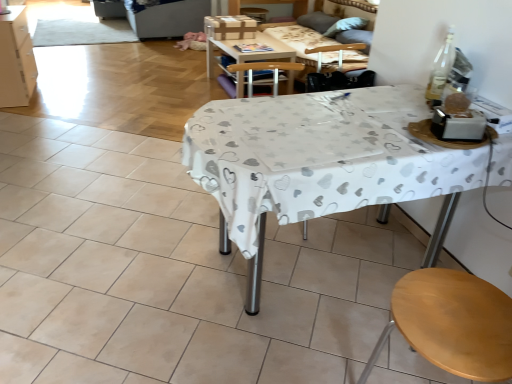
Question: From a real-world perspective, is white matte cabinet at left above or below white fabric-covered table at center?

Choices:
 (A) above
 (B) below

Answer: (B)

Question: Would you say white matte cabinet at left is to the left or to the right of white fabric-covered table at center in the picture?

Choices:
 (A) right
 (B) left

Answer: (B)

Question: Which object is the closest to the white fabric-covered table at center?

Choices:
 (A) brown cardboard box at upper center
 (B) wooden couch at upper center
 (C) white matte cabinet at left
 (D) wooden table at center

Answer: (D)

Question: Based on their relative distances, which object is nearer to the wooden table at center?

Choices:
 (A) white matte cabinet at left
 (B) white fabric-covered table at center
 (C) wooden couch at upper center
 (D) brown cardboard box at upper center

Answer: (D)